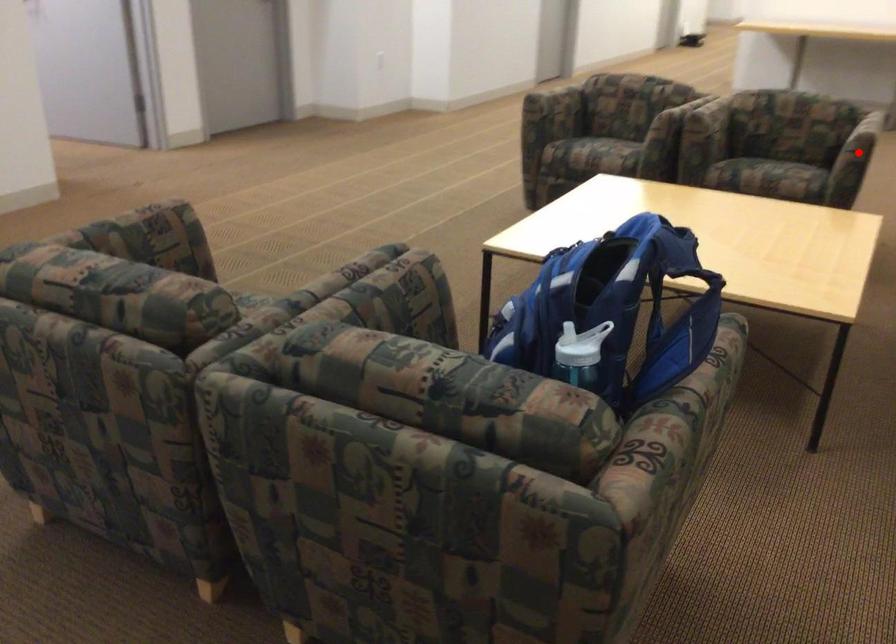
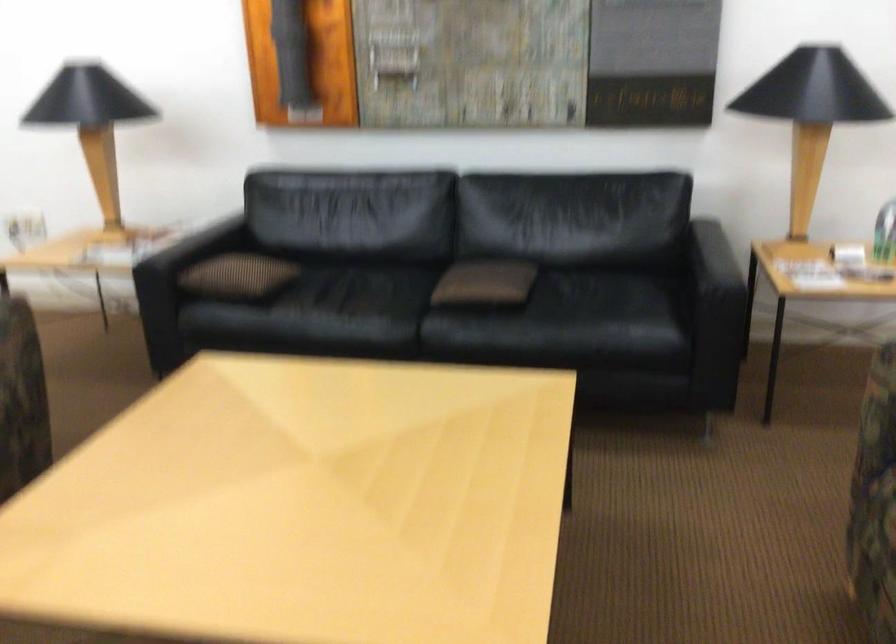
Question: I am providing you with two images of the same scene from different viewpoints. A red point is marked on the first image. Can you still see the location of the red point in image 2?

Choices:
 (A) Yes
 (B) No

Answer: (B)